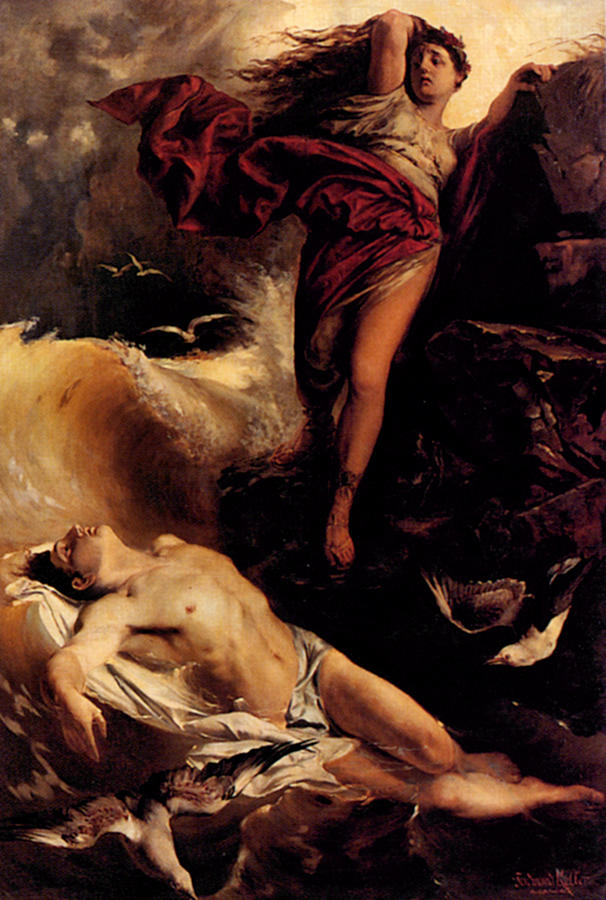
Locate an element on the screen. the chest is located at coordinates (205, 598).